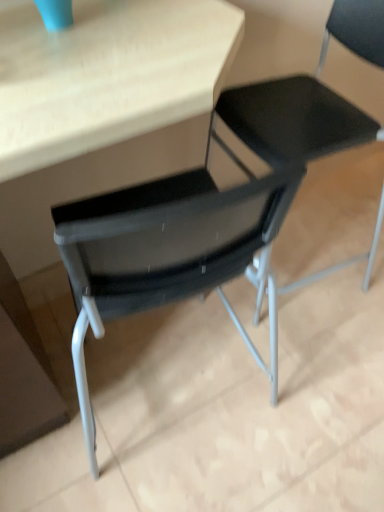
In order to click on vacant space situated above black mesh chair at center, placed as the first chair when sorted from right to left (from a real-world perspective) in this screenshot , I will do `click(265, 337)`.